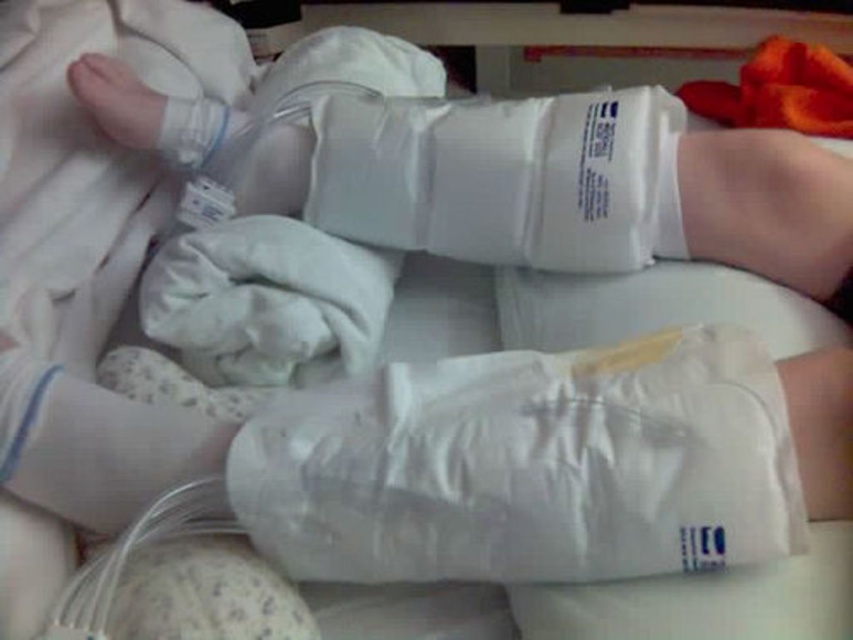
Question: Does white matte bandage at center have a smaller size compared to white smooth foot at upper left?

Choices:
 (A) yes
 (B) no

Answer: (B)

Question: Among these objects, which one is nearest to the camera?

Choices:
 (A) white matte bandage at center
 (B) white smooth foot at upper left

Answer: (A)

Question: Which object appears farthest from the camera in this image?

Choices:
 (A) white smooth foot at upper left
 (B) white matte bandage at center

Answer: (A)

Question: In this image, where is white matte bandage at center located relative to white smooth foot at upper left?

Choices:
 (A) right
 (B) left

Answer: (A)

Question: Observing the image, what is the correct spatial positioning of white matte bandage at center in reference to white smooth foot at upper left?

Choices:
 (A) left
 (B) right

Answer: (B)

Question: Which of the following is the farthest from the observer?

Choices:
 (A) white matte bandage at center
 (B) white smooth foot at upper left

Answer: (B)